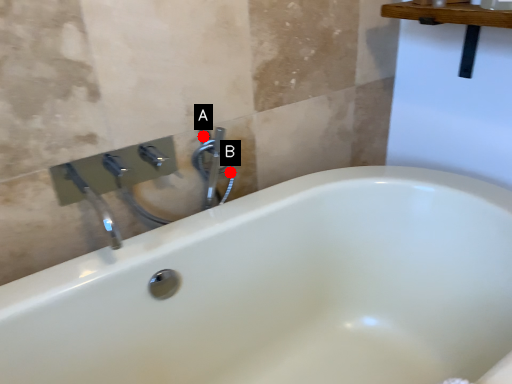
Question: Two points are circled on the image, labeled by A and B beside each circle. Among these points, which one is nearest to the camera?

Choices:
 (A) A is closer
 (B) B is closer

Answer: (A)